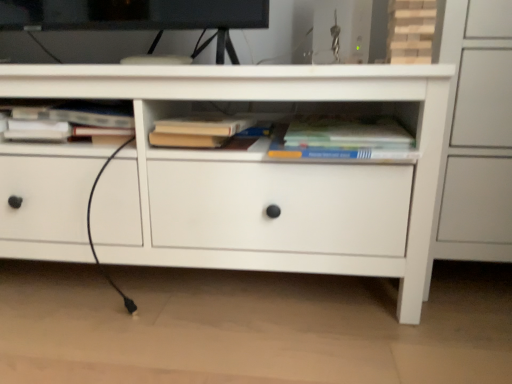
Question: Is hardcover book at center, the second book viewed from the right, facing away from white matte chest of drawers at center?

Choices:
 (A) no
 (B) yes

Answer: (B)

Question: From a real-world perspective, does hardcover book at center, which appears as the 2th book when viewed from the left, stand above white matte chest of drawers at center?

Choices:
 (A) yes
 (B) no

Answer: (A)

Question: Is hardcover book at center, the second book viewed from the right, next to white matte chest of drawers at center and touching it?

Choices:
 (A) yes
 (B) no

Answer: (B)

Question: From the image's perspective, is hardcover book at center, the second book viewed from the right, below white matte chest of drawers at center?

Choices:
 (A) no
 (B) yes

Answer: (A)

Question: Can you confirm if hardcover book at center, the second book viewed from the right, is thinner than white matte chest of drawers at center?

Choices:
 (A) yes
 (B) no

Answer: (A)

Question: From the image's perspective, is hardcover book at upper left, which appears as the third book when viewed from the right, located above or below hardcover book at center, arranged as the third book when viewed from the left?

Choices:
 (A) below
 (B) above

Answer: (B)

Question: Is hardcover book at upper left, which appears as the third book when viewed from the right, taller or shorter than hardcover book at center, the 1th book in the right-to-left sequence?

Choices:
 (A) short
 (B) tall

Answer: (B)

Question: Is hardcover book at upper left, the first book positioned from the left, in front of or behind hardcover book at center, the 1th book in the right-to-left sequence, in the image?

Choices:
 (A) front
 (B) behind

Answer: (B)

Question: In terms of width, does hardcover book at upper left, which appears as the third book when viewed from the right, look wider or thinner when compared to hardcover book at center, arranged as the third book when viewed from the left?

Choices:
 (A) wide
 (B) thin

Answer: (A)

Question: From the image's perspective, is hardcover book at center, the second book viewed from the right, positioned above or below hardcover book at upper left, the first book positioned from the left?

Choices:
 (A) below
 (B) above

Answer: (A)

Question: From a real-world perspective, is hardcover book at center, which appears as the 2th book when viewed from the left, above or below hardcover book at upper left, which appears as the third book when viewed from the right?

Choices:
 (A) below
 (B) above

Answer: (A)

Question: Based on their sizes in the image, would you say hardcover book at center, the second book viewed from the right, is bigger or smaller than hardcover book at upper left, the first book positioned from the left?

Choices:
 (A) small
 (B) big

Answer: (A)

Question: Does point tap(259, 134) appear closer or farther from the camera than point tap(98, 122)?

Choices:
 (A) closer
 (B) farther

Answer: (B)

Question: In terms of width, does white matte chest of drawers at center look wider or thinner when compared to hardcover book at center, arranged as the third book when viewed from the left?

Choices:
 (A) thin
 (B) wide

Answer: (B)

Question: Considering the positions of point (335, 162) and point (377, 122), is point (335, 162) closer or farther from the camera than point (377, 122)?

Choices:
 (A) closer
 (B) farther

Answer: (A)